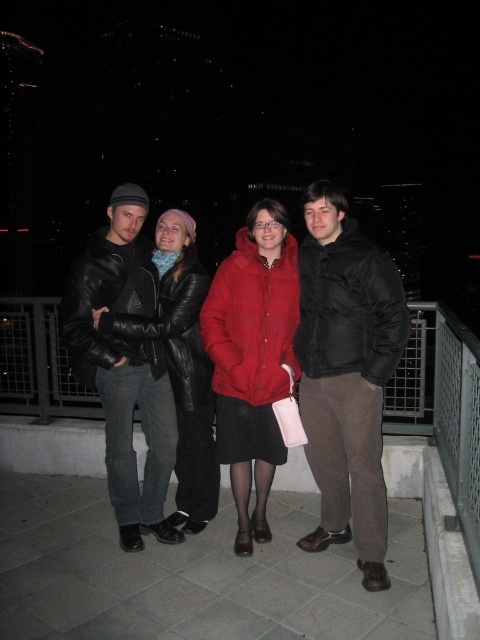
Question: Which point is farther from the camera taking this photo?

Choices:
 (A) (132, 538)
 (B) (326, 348)
 (C) (267, 285)

Answer: (A)

Question: Does leather jacket at left appear on the right side of matte red coat at center?

Choices:
 (A) yes
 (B) no

Answer: (B)

Question: Which point appears closest to the camera in this image?

Choices:
 (A) (163, 476)
 (B) (340, 216)

Answer: (B)

Question: Does black matte jacket at right appear under matte red coat at center?

Choices:
 (A) yes
 (B) no

Answer: (B)

Question: Is black matte jacket at right below matte red coat at center?

Choices:
 (A) yes
 (B) no

Answer: (B)

Question: Which point is closer to the camera taking this photo?

Choices:
 (A) (264, 298)
 (B) (351, 442)
 (C) (107, 268)

Answer: (B)